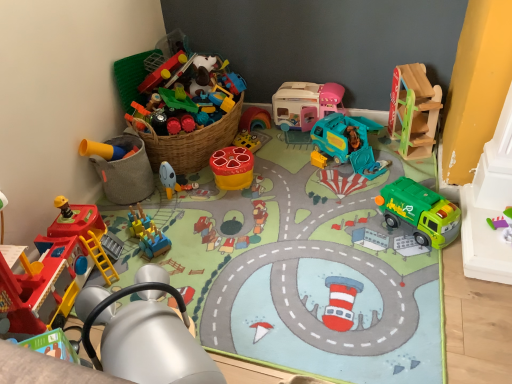
Locate an element on the screen. empty space that is in between yellow matte bucket at lower left, the 9th toy when ordered from right to left, and matte plastic toy at center, the 7th toy viewed from the right is located at coordinates click(166, 196).